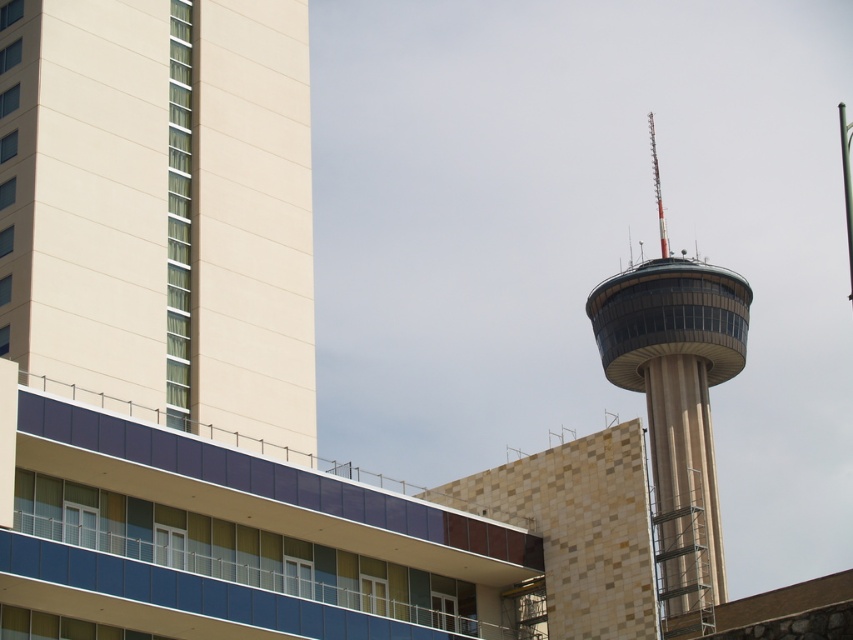
You are a city planner who needs to install a new streetlight between the beige concrete tower at left and the beige stone tower at right. The streetlight requires a minimum of 20 meters of space between the two towers to be installed safely. Based on the cityscape, can the streetlight be placed between them?

The beige concrete tower at left is 21.40 meters away from the beige stone tower at right. Since the required minimum distance is 20 meters, the streetlight can be safely installed between them as the distance meets the requirement.

You are an urban planner analyzing the city layout. Given the coordinates of the beige concrete tower at left, can you determine its location relative to the center of the image?

The beige concrete tower at left is located at coordinates point (161, 205), which places it to the lower left of the image center since both x and y values are less than 0.5.

You are an urban planner assessing the city layout. You need to determine which of the two towers, the beige concrete tower at left or the beige stone tower at right, has a larger footprint. Based on their appearances, which one would you estimate to have a bigger base area?

The beige stone tower at right has a larger footprint because it is wider than the beige concrete tower at left, as indicated by the description stating the beige concrete tower at left is thinner than the beige stone tower at right.